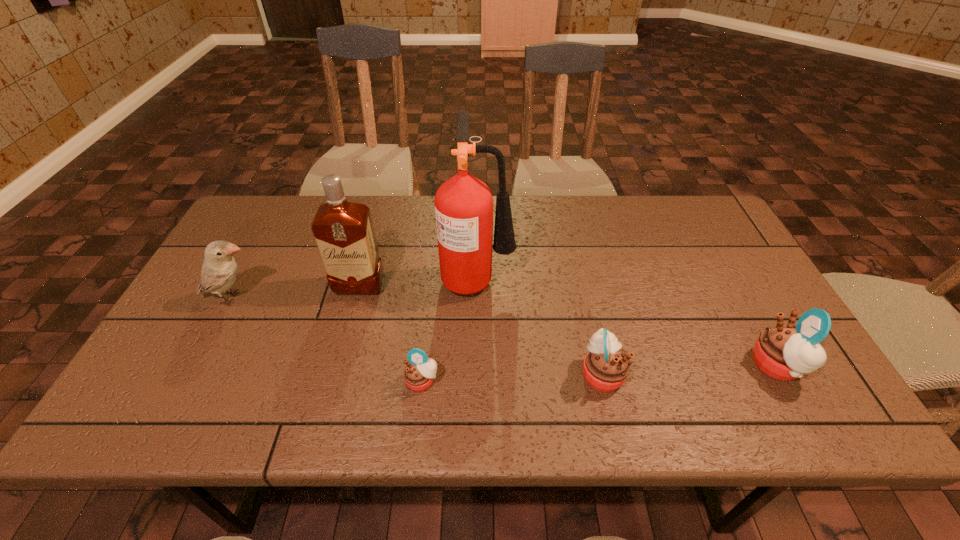
Observe the arrangement of all muffins in the image. To keep them evenly spaced, where would you place another muffin on the left? Please locate a free space. Please provide its 2D coordinates. Your answer should be formatted as a tuple, i.e. [(x, y)], where the tuple contains the x and y coordinates of a point satisfying the conditions above.

[(237, 389)]